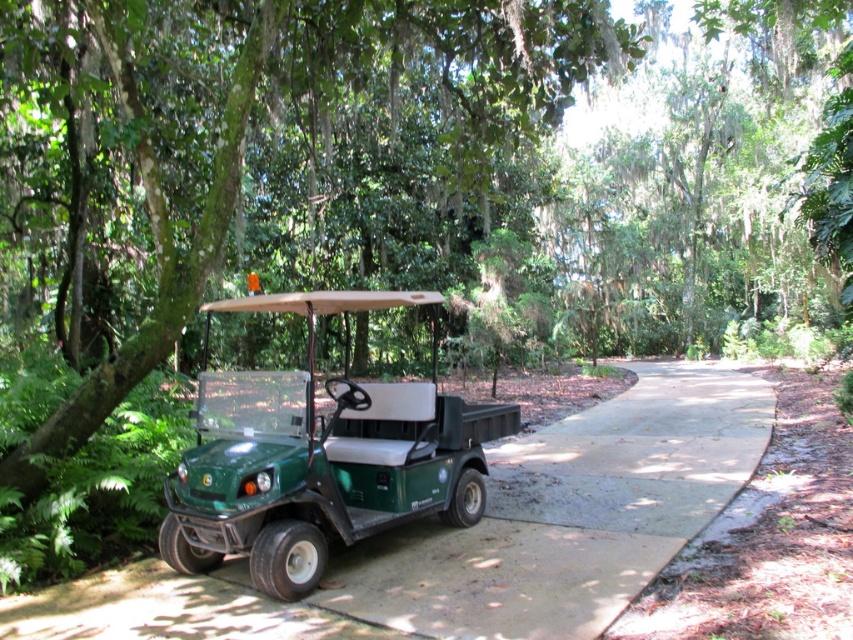
Question: Is green rubber pavement at center thinner than green matte golf cart at center?

Choices:
 (A) no
 (B) yes

Answer: (A)

Question: Can you confirm if green rubber pavement at center is bigger than green matte golf cart at center?

Choices:
 (A) no
 (B) yes

Answer: (B)

Question: Which point is farther from the camera taking this photo?

Choices:
 (A) (672, 429)
 (B) (397, 464)

Answer: (A)

Question: Does green rubber pavement at center have a larger size compared to green matte golf cart at center?

Choices:
 (A) yes
 (B) no

Answer: (A)